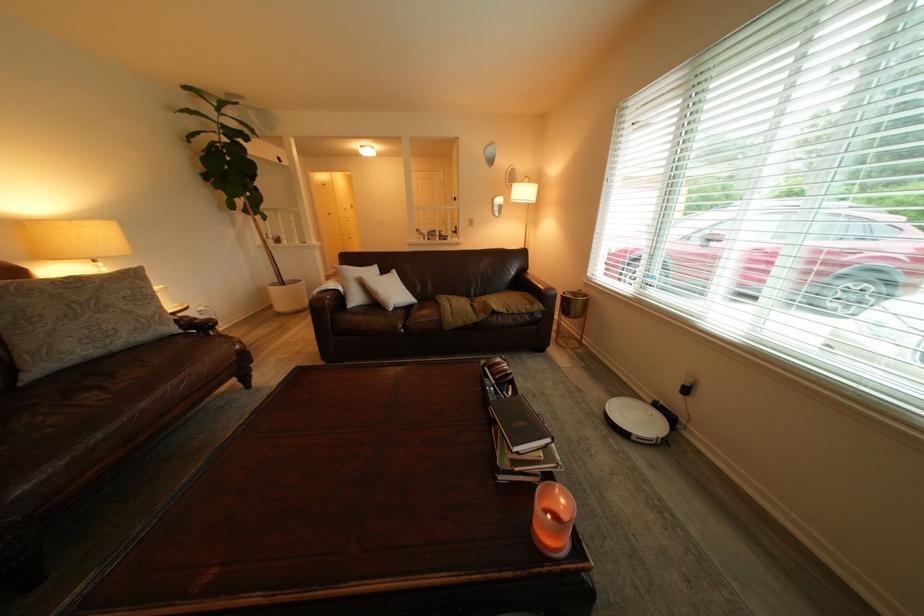
Identify the location of sofa sitting surface. (469, 309).